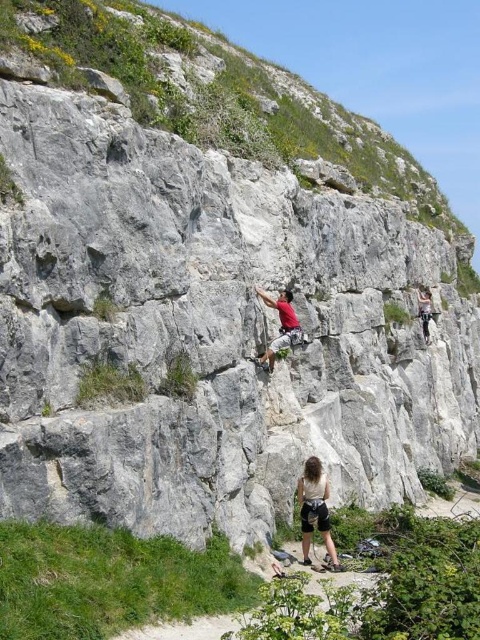
What do you see at coordinates (220, 97) in the screenshot? The width and height of the screenshot is (480, 640). I see `white rock climbing wall at center` at bounding box center [220, 97].

Find the location of a particular element. white rock climbing wall at center is located at coordinates (220, 97).

Who is higher up, white rock climbing wall at center or dark gray fabric pants at center?

Positioned higher is white rock climbing wall at center.

Is point (343, 109) positioned in front of point (311, 476)?

No, (343, 109) is behind (311, 476).

You are a GUI agent. You are given a task and a screenshot of the screen. Output one action in this format:
    pyautogui.click(x=<x>, y=<y>)
    Task: Click on the white rock climbing wall at center
    This screenshot has width=480, height=640.
    Given the screenshot: What is the action you would take?
    pyautogui.click(x=220, y=97)

Which is in front, point (304, 504) or point (283, 324)?

Point (304, 504) is more forward.

Is dark gray fabric pants at center below matte red shirt at center?

Correct, dark gray fabric pants at center is located below matte red shirt at center.

Is point (311, 516) in front of point (273, 301)?

Yes, point (311, 516) is in front of point (273, 301).

This screenshot has height=640, width=480. In order to click on dark gray fabric pants at center in this screenshot , I will do coord(314,509).